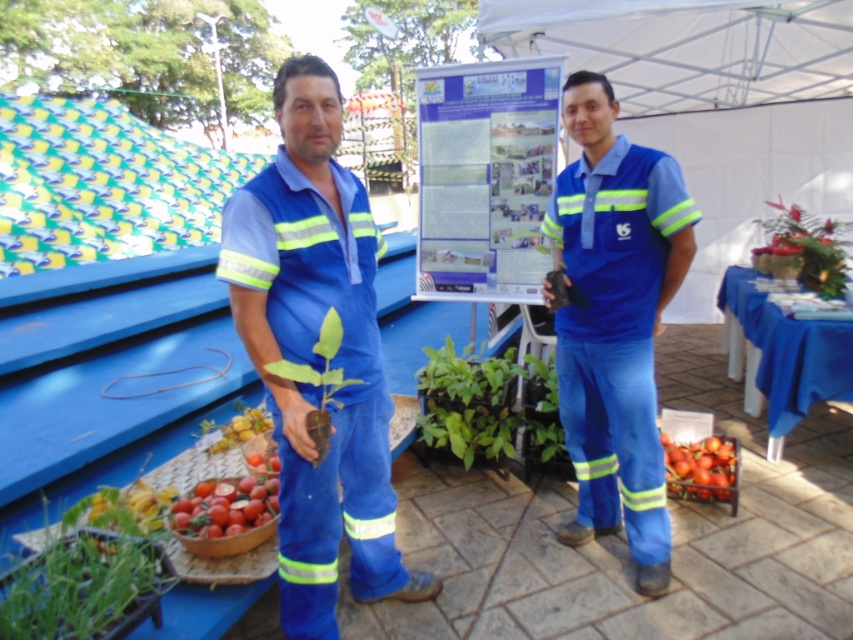
Question: Which object is farther from the camera taking this photo?

Choices:
 (A) green leafy plant at center
 (B) green leafy plant at upper right

Answer: (B)

Question: Is green leafy plant at center bigger than shiny red tomatoes at lower left?

Choices:
 (A) no
 (B) yes

Answer: (B)

Question: Considering the relative positions of green leafy plant at upper right and smooth red tomato at lower left in the image provided, where is green leafy plant at upper right located with respect to smooth red tomato at lower left?

Choices:
 (A) below
 (B) above

Answer: (B)

Question: Estimate the real-world distances between objects in this image. Which object is farther from the smooth glossy tomatoes at center?

Choices:
 (A) smooth red tomato at lower left
 (B) green leafy plant at center
 (C) blue fabric table at lower right

Answer: (A)

Question: Which is nearer to the blue fabric shirt at center?

Choices:
 (A) blue fabric table at lower right
 (B) shiny red tomatoes at lower left
 (C) green leafy plant at lower left

Answer: (B)

Question: Where is blue fabric table at lower right located in relation to smooth red tomato at lower left in the image?

Choices:
 (A) right
 (B) left

Answer: (A)